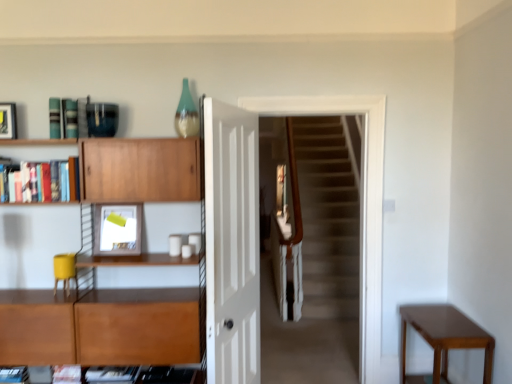
Question: Is point (488, 362) positioned closer to the camera than point (202, 329)?

Choices:
 (A) farther
 (B) closer

Answer: (B)

Question: From a real-world perspective, is mahogany wood table at lower right positioned above or below wooden cabinet at left, which is the second shelf in top-to-bottom order?

Choices:
 (A) above
 (B) below

Answer: (B)

Question: Estimate the real-world distances between objects in this image. Which object is farther from the mahogany wood table at lower right?

Choices:
 (A) carpeted stairs at center
 (B) wooden cabinet at left, the first shelf ordered from the bottom
 (C) wooden bookshelf at upper left, which is the 1th shelf in top-to-bottom order
 (D) matte white picture frame at upper left, marked as the first picture frame in a top-to-bottom arrangement
 (E) matte white picture frame at upper left, marked as the 1th picture frame in a bottom-to-top arrangement

Answer: (D)

Question: Which is nearer to the mahogany wood table at lower right?

Choices:
 (A) wooden cabinet at left, the first shelf ordered from the bottom
 (B) carpeted stairs at center
 (C) matte white picture frame at upper left, the second picture frame positioned from the left
 (D) matte white picture frame at upper left, marked as the first picture frame in a top-to-bottom arrangement
 (E) white glossy door at center

Answer: (B)